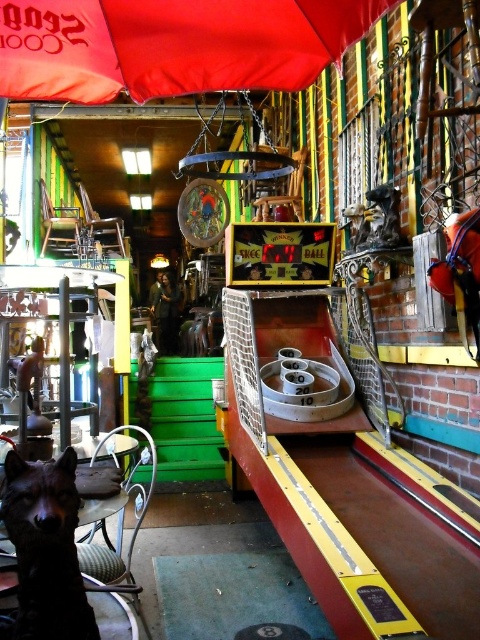
You are a visitor in this store and want to take a photo of the black fur dog at lower left without it getting wet from the rain. Is the red fabric umbrella at upper center currently providing shade over the dog?

The red fabric umbrella at upper center is positioned over the black fur dog at lower left, so yes, it is currently providing shade over the dog.

You are standing in the middle of the room and want to grab the red fabric umbrella at upper center. Which direction should you move to reach it?

The red fabric umbrella at upper center is located at point 0.072 in the x coordinate, which is to the left side of the room. Move towards the left to reach it.

You are standing in the middle of the room and want to move towards the two points marked in the image. Which point, point [206,29] or point [85,625], is closer to you?

Point [206,29] is closer to you because it is further to the viewer than point [85,625], which means it is physically nearer in the scene.